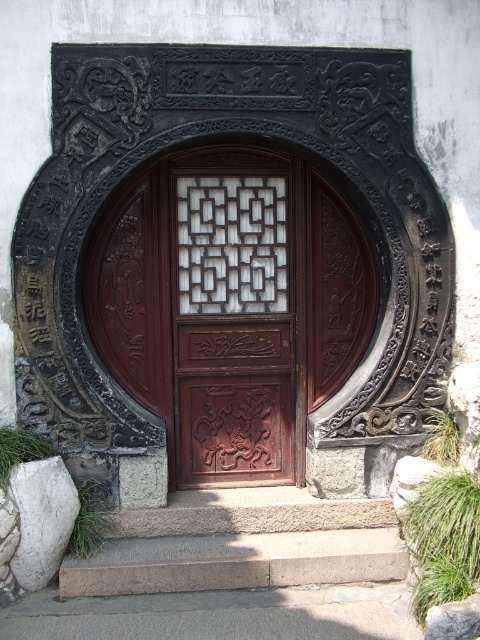
You are standing in front of a traditional Chinese door with intricate carvings. There are two points marked on the door frame and carvings. The first point is at coordinates point (273, 161) and the second is at point (35, 589). If you were to reach out and touch these points, which one would feel closer to your hand?

Point (35, 589) is closer to you than point (273, 161), so touching point (35, 589) would feel closer to your hand.